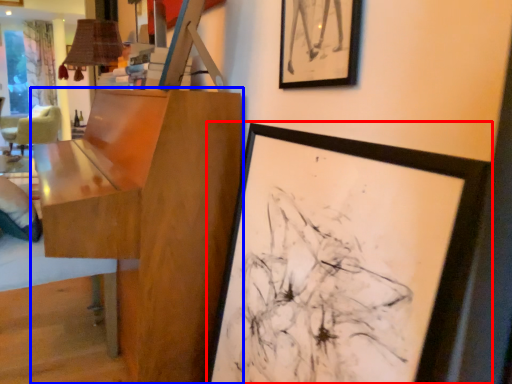
Question: Which of the following is the farthest to the observer, picture frame (highlighted by a red box) or table (highlighted by a blue box)?

Choices:
 (A) picture frame
 (B) table

Answer: (B)